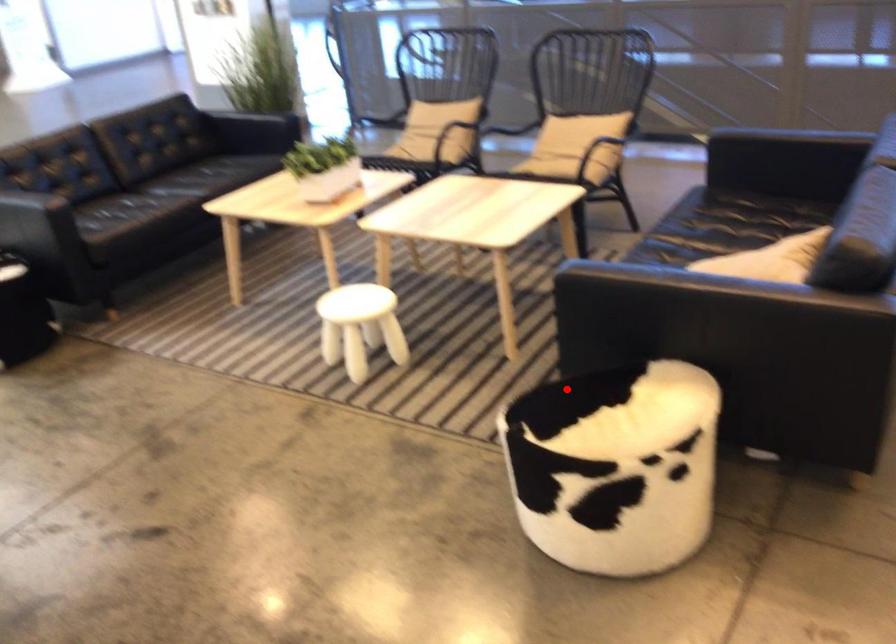
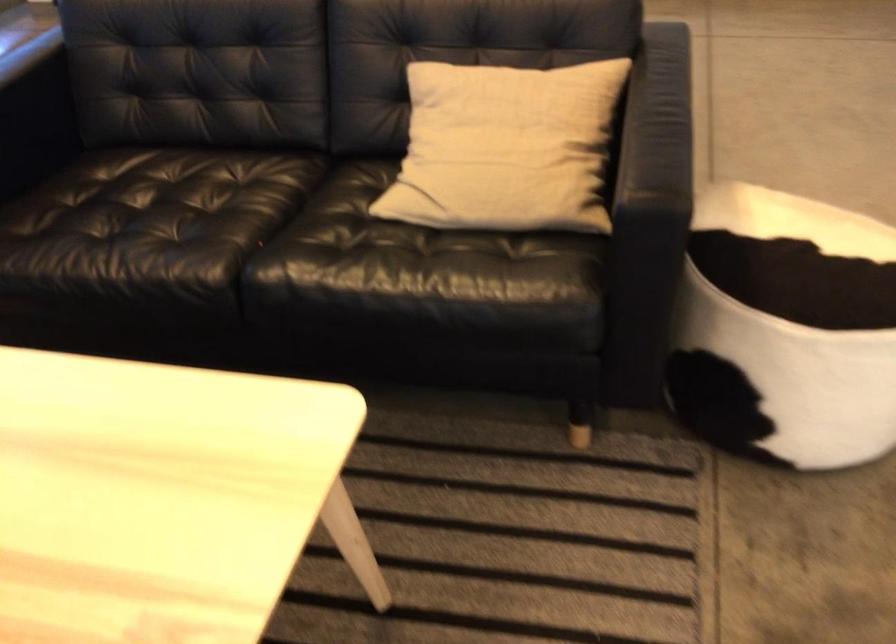
Question: I am providing you with two images of the same scene from different viewpoints. Given a red point in image1, look at the same physical point in image2. Is it:

Choices:
 (A) Closer to the viewpoint
 (B) Farther from the viewpoint

Answer: (A)